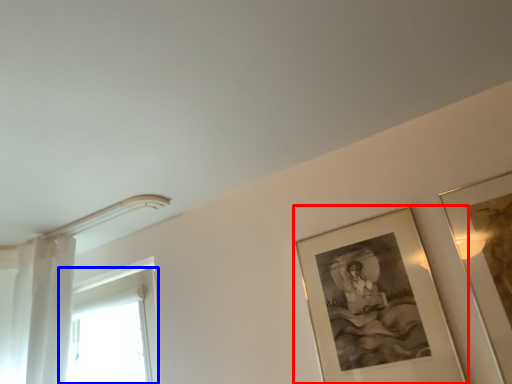
Question: Which object appears closest to the camera in this image, picture frame (highlighted by a red box) or window (highlighted by a blue box)?

Choices:
 (A) picture frame
 (B) window

Answer: (A)